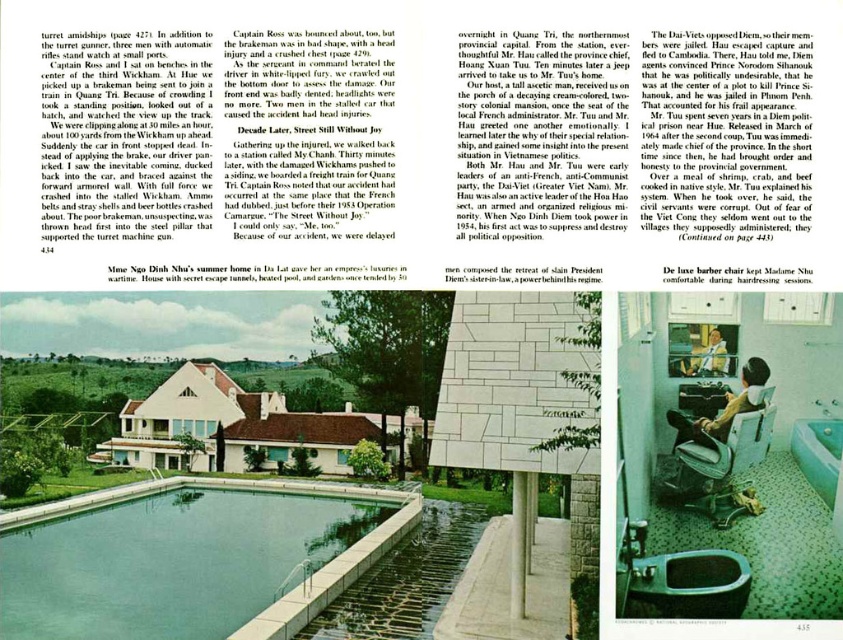
Question: Does green concrete pool at center lie in front of matte porcelain toilet bowl at lower center?

Choices:
 (A) yes
 (B) no

Answer: (B)

Question: Which point is closer to the camera?

Choices:
 (A) (717, 355)
 (B) (313, 592)

Answer: (A)

Question: Does green concrete pool at center appear on the right side of light brown wooden chair at lower center?

Choices:
 (A) yes
 (B) no

Answer: (B)

Question: Which of the following is the closest to the observer?

Choices:
 (A) light brown wooden chair at lower center
 (B) smooth wooden chair at lower right

Answer: (B)

Question: Which point is closer to the camera taking this photo?

Choices:
 (A) (250, 624)
 (B) (756, 374)

Answer: (B)

Question: Does green concrete pool at center appear under matte porcelain toilet bowl at lower center?

Choices:
 (A) no
 (B) yes

Answer: (B)